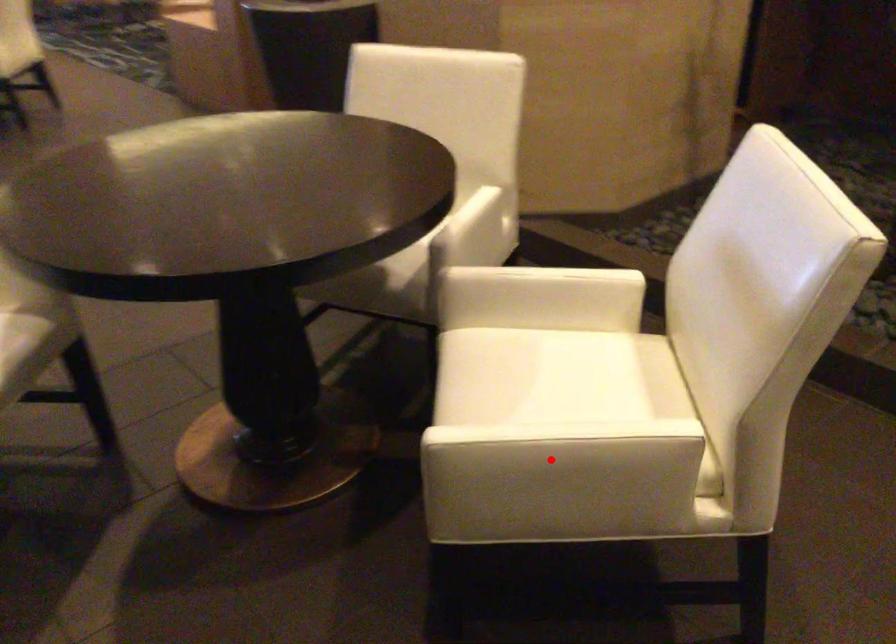
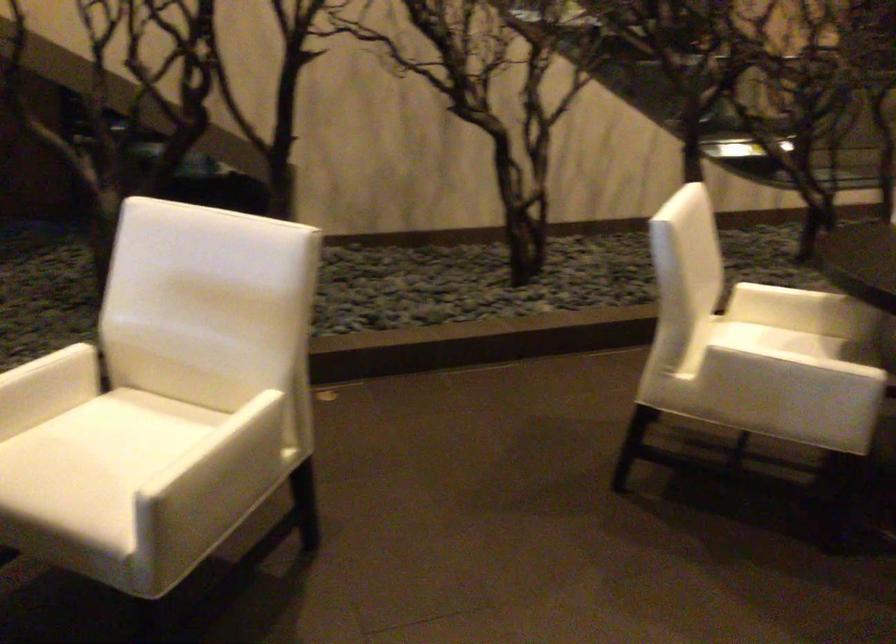
Where in the second image is the point corresponding to the highlighted location from the first image?

(225, 462)